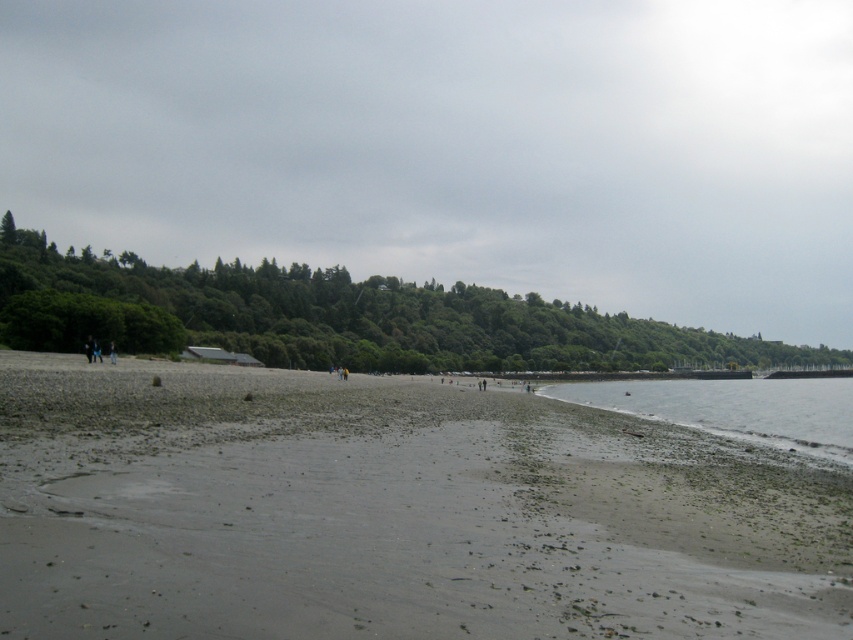
Question: Among these objects, which one is nearest to the camera?

Choices:
 (A) clear water at lower right
 (B) smooth sand beach at center

Answer: (B)

Question: Is smooth sand beach at center smaller than clear water at lower right?

Choices:
 (A) no
 (B) yes

Answer: (B)

Question: Which is nearer to the green leafy hillside at upper center?

Choices:
 (A) clear water at lower right
 (B) smooth sand beach at center

Answer: (A)

Question: Does smooth sand beach at center appear on the right side of clear water at lower right?

Choices:
 (A) no
 (B) yes

Answer: (A)

Question: Is green leafy hillside at upper center positioned before smooth sand beach at center?

Choices:
 (A) no
 (B) yes

Answer: (A)

Question: Which object appears farthest from the camera in this image?

Choices:
 (A) green leafy hillside at upper center
 (B) clear water at lower right
 (C) smooth sand beach at center

Answer: (A)